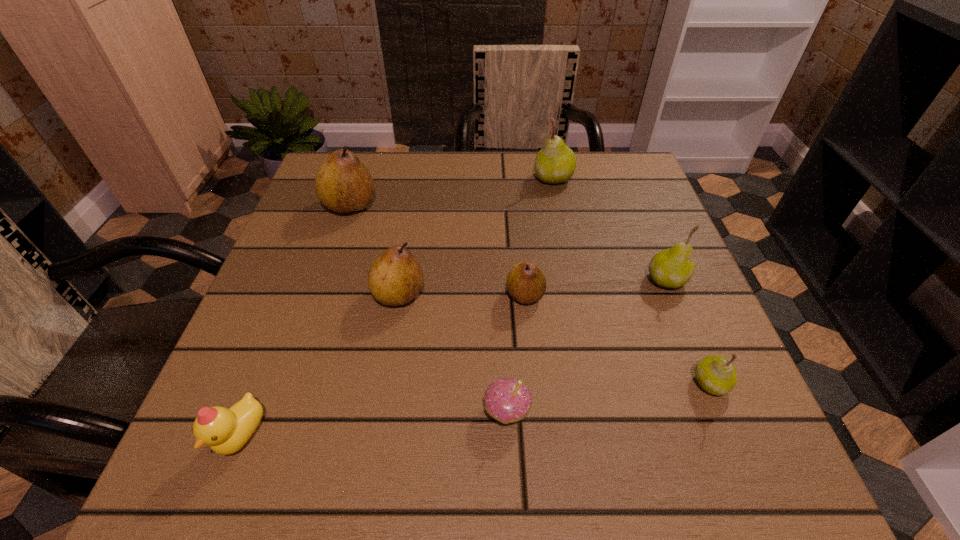
Locate an element on the screen. The height and width of the screenshot is (540, 960). free space at the far left corner of the desktop is located at coordinates (324, 159).

This screenshot has height=540, width=960. I want to click on free space at the near left corner of the desktop, so click(x=234, y=489).

The image size is (960, 540). I want to click on vacant space at the far right corner of the desktop, so click(x=633, y=194).

The width and height of the screenshot is (960, 540). I want to click on unoccupied area between the smallest green pear and the second pear from left to right, so click(x=555, y=339).

What are the coordinates of `vacant area between the farthest green pear and the third object from left to right` in the screenshot? It's located at (476, 237).

Where is `vacant region between the third pear from right to left and the third pear from left to right`? This screenshot has width=960, height=540. vacant region between the third pear from right to left and the third pear from left to right is located at coordinates (540, 237).

Where is `empty space between the second brown pear from left to right and the nearest green pear`? Image resolution: width=960 pixels, height=540 pixels. empty space between the second brown pear from left to right and the nearest green pear is located at coordinates (555, 339).

Locate an element on the screen. The width and height of the screenshot is (960, 540). empty space that is in between the smallest green pear and the cupcake is located at coordinates (609, 397).

This screenshot has width=960, height=540. What are the coordinates of `unoccupied position between the third pear from left to right and the yellow duckling` in the screenshot? It's located at (383, 366).

I want to click on vacant space that's between the biggest brown pear and the farthest pear, so click(x=451, y=192).